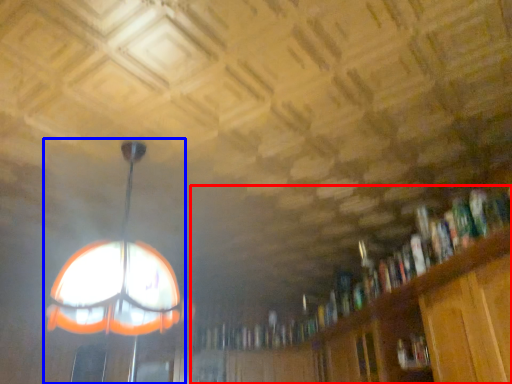
Question: Which point is further to the camera, bookcase (highlighted by a red box) or lamp (highlighted by a blue box)?

Choices:
 (A) bookcase
 (B) lamp

Answer: (B)